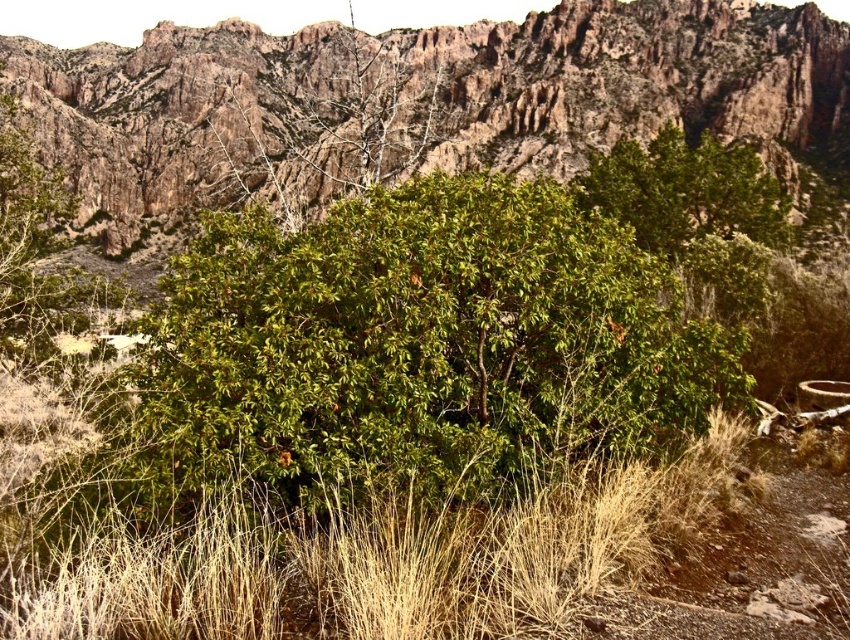
You are a hiker planning to take a photo of the rugged rock mountain at center from the green leafy bush at center. Will the bush block your view of the mountain?

The green leafy bush at center is in front of the rugged rock mountain at center, so it will block your view of the mountain.

You are a hiker who wants to take a photo of the green leafy bush at center. Where should you position yourself to capture it in the center of your camera viewfinder?

You should position yourself directly in front of the green leafy bush at center to ensure it is centered in your camera viewfinder, as its 2D coordinates are at point (x=420, y=348).